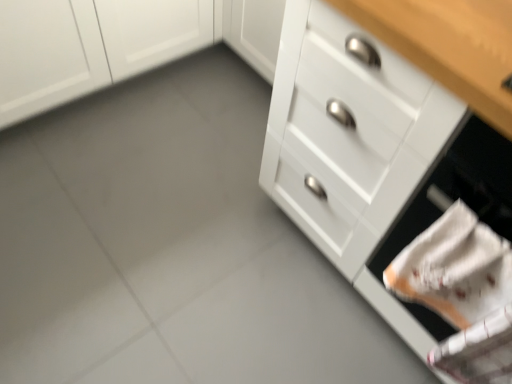
Question: In terms of width, does white matte cabinet at upper left look wider or thinner when compared to white matte drawer at lower right?

Choices:
 (A) wide
 (B) thin

Answer: (B)

Question: Is white matte cabinet at upper left spatially inside white matte drawer at lower right, or outside of it?

Choices:
 (A) outside
 (B) inside

Answer: (A)

Question: Estimate the real-world distances between objects in this image. Which object is closer to the white matte cabinet at upper left?

Choices:
 (A) white matte drawer at lower right
 (B) white glossy drawer at right

Answer: (B)

Question: Considering the real-world distances, which object is farthest from the white matte drawer at lower right?

Choices:
 (A) white glossy drawer at right
 (B) white matte cabinet at upper left

Answer: (B)